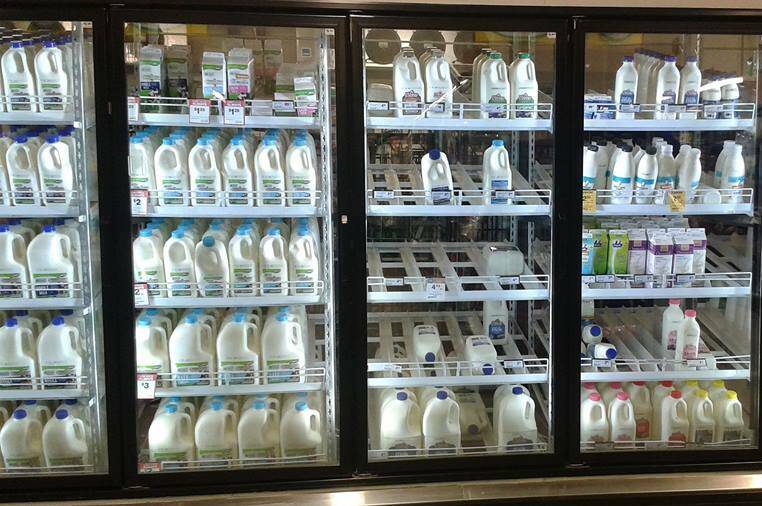
In order to click on glass doors in this screenshot , I will do `click(706, 144)`, `click(482, 147)`, `click(296, 158)`, `click(74, 172)`.